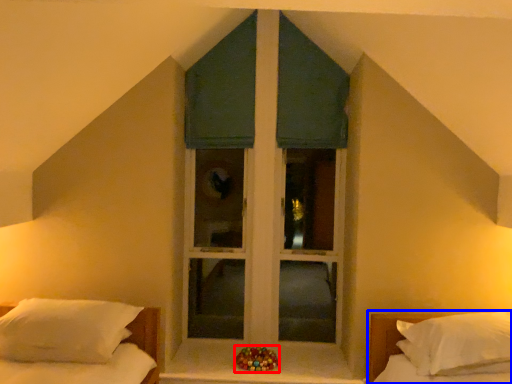
Question: Which object appears farthest to the camera in this image, miniature (highlighted by a red box) or bed (highlighted by a blue box)?

Choices:
 (A) miniature
 (B) bed

Answer: (A)